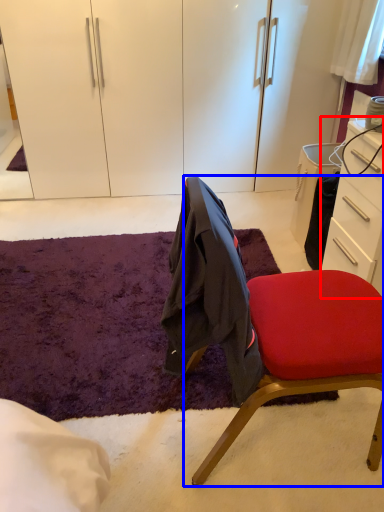
Question: Which point is further to the camera, desk (highlighted by a red box) or chair (highlighted by a blue box)?

Choices:
 (A) desk
 (B) chair

Answer: (A)